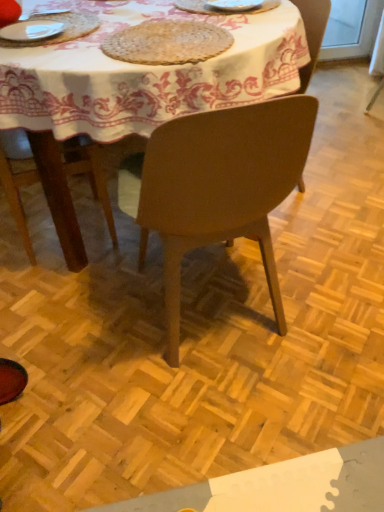
You are a GUI agent. You are given a task and a screenshot of the screen. Output one action in this format:
    pyautogui.click(x=<x>, y=<y>)
    Task: Click on the free location in front of white fabric tablecloth at center
    
    Given the screenshot: What is the action you would take?
    pyautogui.click(x=181, y=389)